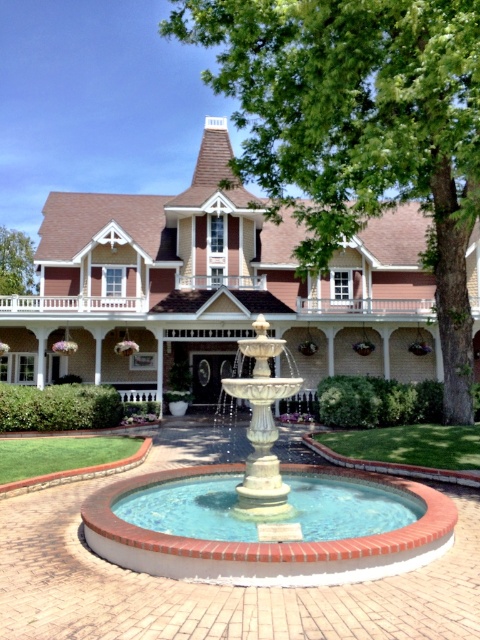
Question: Which is farther from the white painted wood porch at upper center?

Choices:
 (A) green leafy tree at center
 (B) green leafy tree at upper center
 (C) white stone fountain at center

Answer: (B)

Question: Can you confirm if white stone fountain at center is bigger than white painted wood porch at upper center?

Choices:
 (A) no
 (B) yes

Answer: (A)

Question: Based on their relative distances, which object is nearer to the white stone fountain at center?

Choices:
 (A) white painted wood porch at upper center
 (B) green leafy tree at center
 (C) green leafy tree at upper center

Answer: (B)

Question: Does green leafy tree at center come behind white painted wood porch at upper center?

Choices:
 (A) no
 (B) yes

Answer: (A)

Question: Which of the following is the closest to the observer?

Choices:
 (A) green leafy tree at center
 (B) white painted wood porch at upper center
 (C) green leafy tree at upper center

Answer: (A)

Question: Where is green leafy tree at center located in relation to white stone fountain at center in the image?

Choices:
 (A) left
 (B) right

Answer: (B)